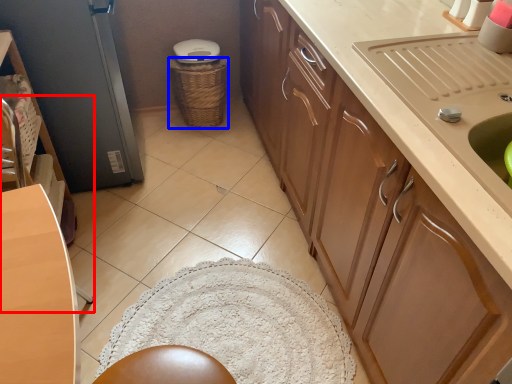
Question: Which object appears closest to the camera in this image, chair (highlighted by a red box) or basket (highlighted by a blue box)?

Choices:
 (A) chair
 (B) basket

Answer: (A)